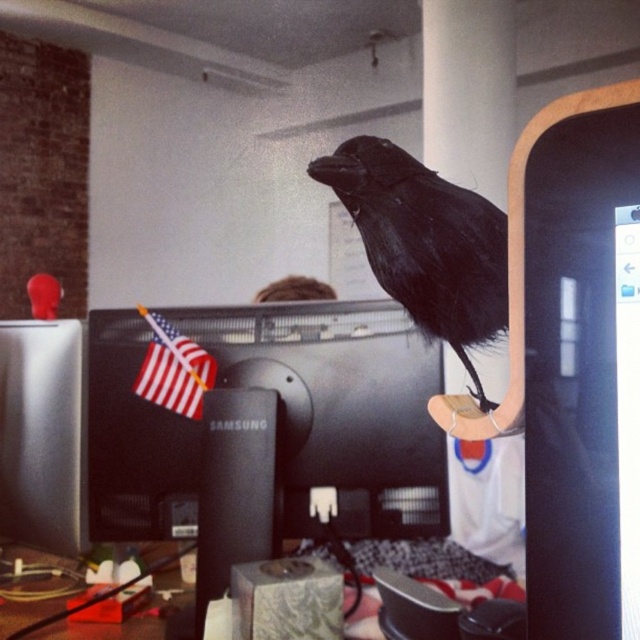
Question: Based on their relative distances, which object is farther from the black matte computer monitor at center?

Choices:
 (A) shiny black bird at center
 (B) american flag with glossy surface at center-left

Answer: (A)

Question: Among these objects, which one is farthest from the camera?

Choices:
 (A) american flag with glossy surface at center-left
 (B) shiny black bird at center
 (C) black matte computer monitor at center

Answer: (A)

Question: Is shiny black bird at center positioned at the back of american flag with glossy surface at center-left?

Choices:
 (A) no
 (B) yes

Answer: (A)

Question: Can you confirm if black matte computer monitor at center is bigger than american flag with glossy surface at center-left?

Choices:
 (A) no
 (B) yes

Answer: (B)

Question: Can you confirm if shiny black bird at center is positioned above american flag with glossy surface at center-left?

Choices:
 (A) yes
 (B) no

Answer: (A)

Question: Considering the real-world distances, which object is closest to the black matte computer monitor at center?

Choices:
 (A) american flag with glossy surface at center-left
 (B) shiny black bird at center

Answer: (A)